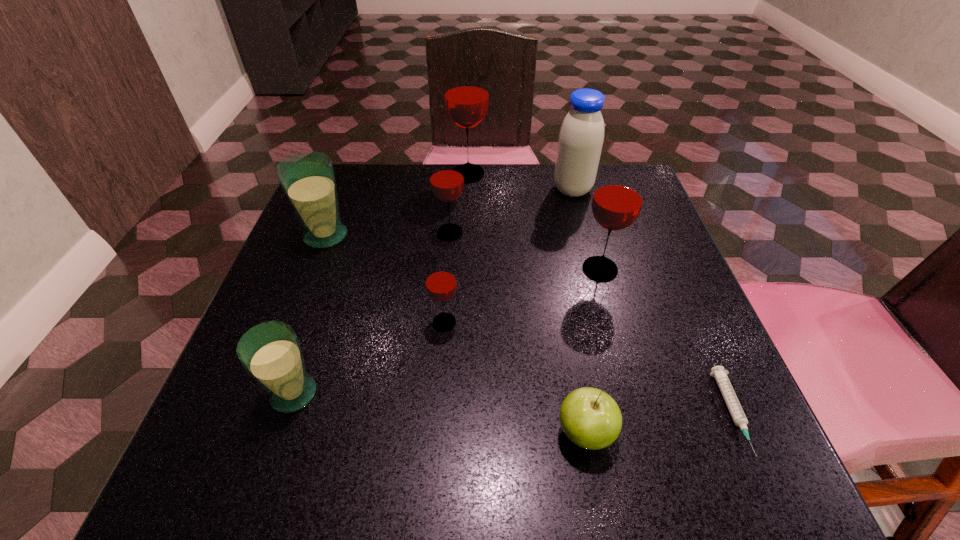
Identify which object is the fifth nearest to the fifth nearest object. Please provide its 2D coordinates. Your answer should be formatted as a tuple, i.e. [(x, y)], where the tuple contains the x and y coordinates of a point satisfying the conditions above.

[(590, 418)]

This screenshot has width=960, height=540. Identify the location of the closest glass to the second smallest red glass. pyautogui.click(x=466, y=90).

At what (x,y) coordinates should I click in order to perform the action: click on the fourth closest glass to the nearest glass. Please return your answer as a coordinate pair (x, y). The image size is (960, 540). Looking at the image, I should click on (618, 198).

I want to click on the closest red glass relative to the bigger blue glass, so click(x=446, y=173).

Locate which red glass is the closest to the sixth farthest object. Please provide its 2D coordinates. Your answer should be formatted as a tuple, i.e. [(x, y)], where the tuple contains the x and y coordinates of a point satisfying the conditions above.

[(446, 173)]

Find the location of a particular element. The image size is (960, 540). vacant space that satisfies the following two spatial constraints: 1. on the back side of the apple; 2. on the right side of the blue soya milk is located at coordinates coord(542,190).

Where is `vacant point that satisfies the following two spatial constraints: 1. on the back side of the soya milk; 2. on the left side of the nearer blue glass`? The width and height of the screenshot is (960, 540). vacant point that satisfies the following two spatial constraints: 1. on the back side of the soya milk; 2. on the left side of the nearer blue glass is located at coordinates (362, 190).